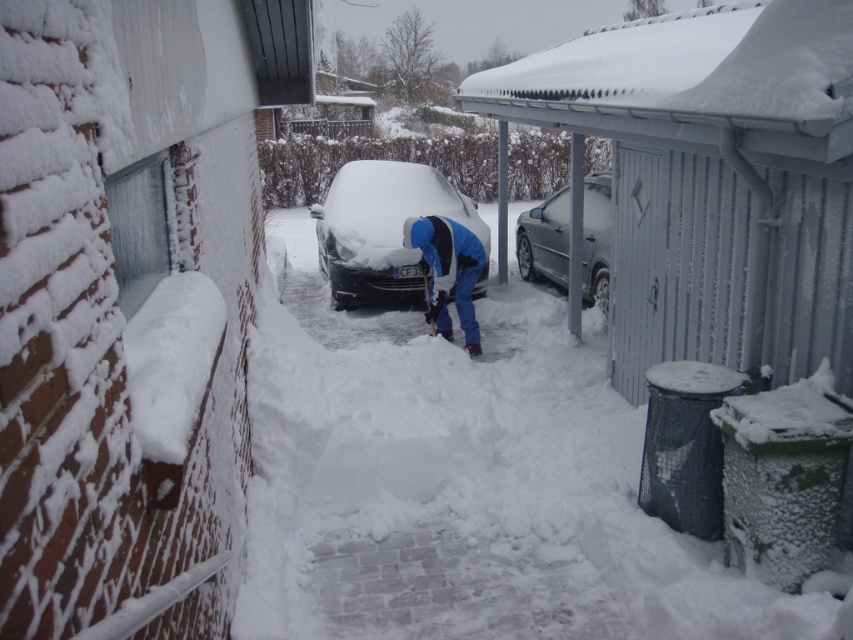
You are a delivery person trying to reach the shiny black car at center to drop off a package. The blue fabric jacket at center belongs to the person shoveling snow. Considering the size difference between the two, which object would you need to move around to access the car?

The shiny black car at center is bigger than the blue fabric jacket at center. To access the car, you would need to move around the blue fabric jacket at center since it is smaller and closer to the path leading to the car.

You are standing in the snowy driveway and notice the blue fabric jacket at center and the white fluffy snow at center. Which object is positioned lower in the scene?

The white fluffy snow at center is located below the blue fabric jacket at center, so it is positioned lower in the scene.